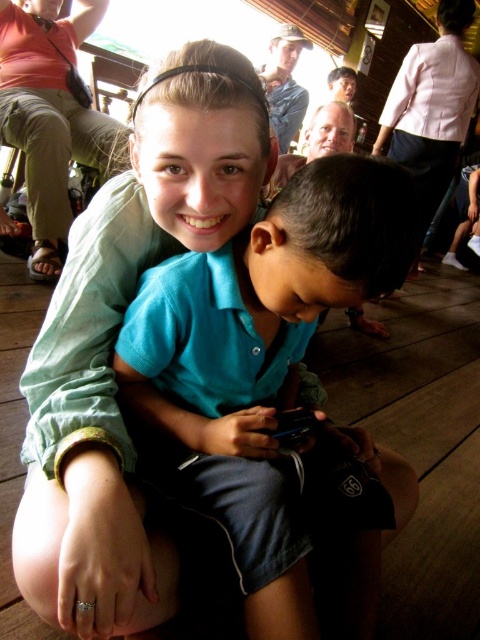
Can you confirm if blue cotton shirt at center is smaller than green cotton shirt at upper center?

Correct, blue cotton shirt at center occupies less space than green cotton shirt at upper center.

What do you see at coordinates (271, 380) in the screenshot? I see `blue cotton shirt at center` at bounding box center [271, 380].

Does point (278, 534) come in front of point (44, 620)?

Yes.

Find the location of a particular element. blue cotton shirt at center is located at coordinates (271, 380).